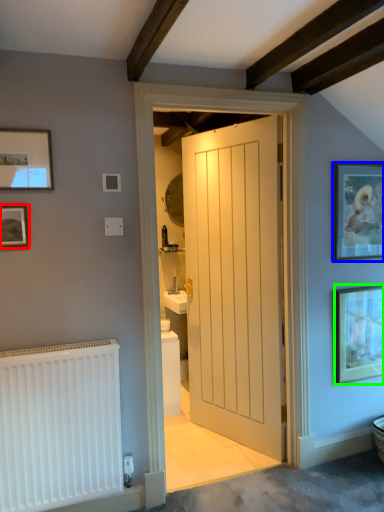
Question: Estimate the real-world distances between objects in this image. Which object is farther from picture frame (highlighted by a red box), picture frame (highlighted by a blue box) or picture frame (highlighted by a green box)?

Choices:
 (A) picture frame
 (B) picture frame

Answer: (B)